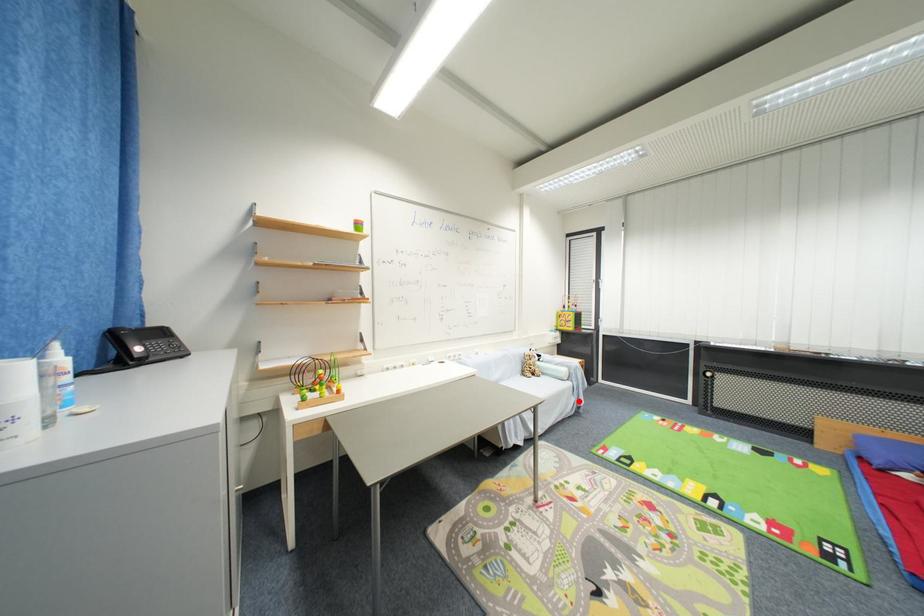
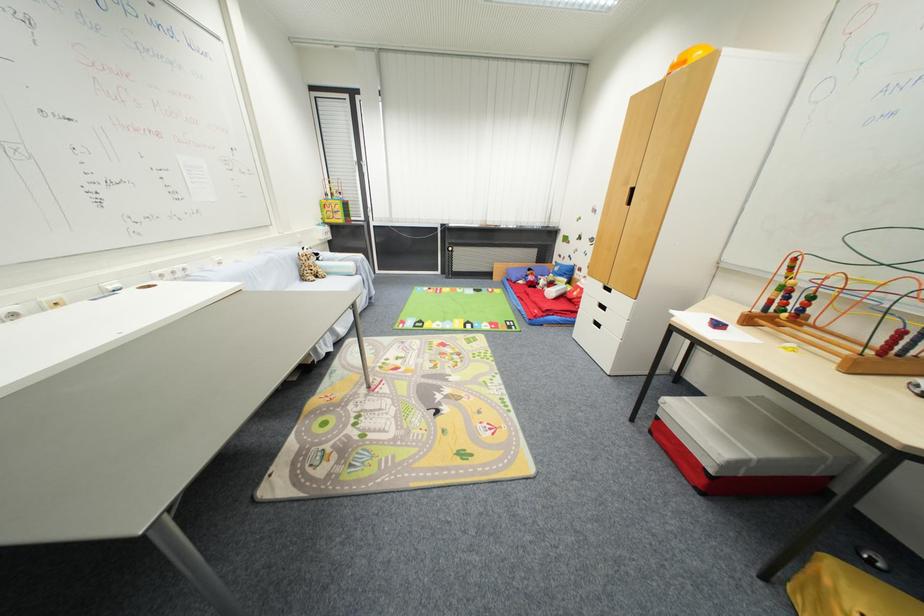
Locate, in the second image, the point that corresponds to the highlighted location in the first image.

(371, 293)